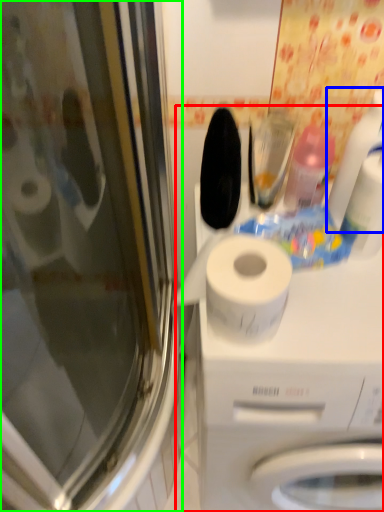
Question: Which object is the farthest from machine (highlighted by a red box)? Choose among these: cleaning product (highlighted by a blue box) or screen door (highlighted by a green box).

Choices:
 (A) cleaning product
 (B) screen door

Answer: (B)